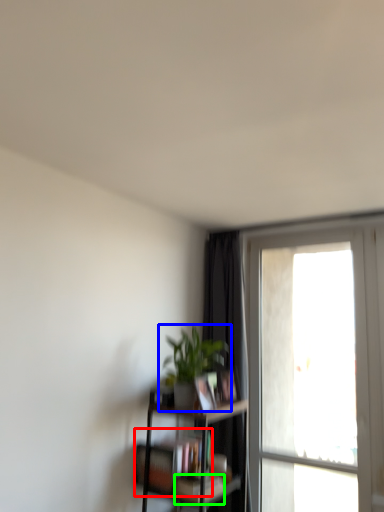
Question: Which object is the closest to the book (highlighted by a red box)? Choose among these: houseplant (highlighted by a blue box) or book (highlighted by a green box).

Choices:
 (A) houseplant
 (B) book

Answer: (B)